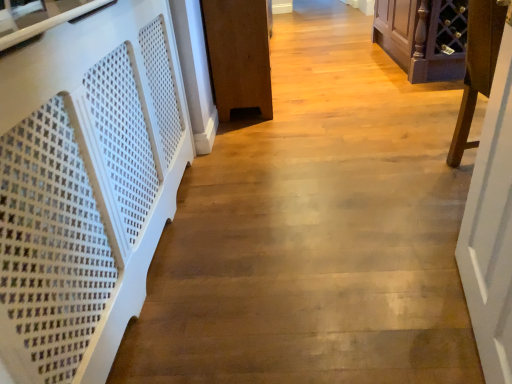
Question: Is purple wood wine rack at right, marked as the 2th furniture in a right-to-left arrangement, with white perforated panel at left?

Choices:
 (A) yes
 (B) no

Answer: (B)

Question: Is purple wood wine rack at right, which appears as the 2th furniture when viewed from the left, outside white perforated panel at left?

Choices:
 (A) no
 (B) yes

Answer: (B)

Question: Is purple wood wine rack at right, which appears as the 2th furniture when viewed from the left, at the left side of white perforated panel at left?

Choices:
 (A) yes
 (B) no

Answer: (B)

Question: Is purple wood wine rack at right, which appears as the 2th furniture when viewed from the left, further to the viewer compared to white perforated panel at left?

Choices:
 (A) no
 (B) yes

Answer: (B)

Question: Can you confirm if purple wood wine rack at right, which appears as the 2th furniture when viewed from the left, is taller than white perforated panel at left?

Choices:
 (A) no
 (B) yes

Answer: (B)

Question: Visually, is white wooden door at right positioned to the left or to the right of white perforated wood at left?

Choices:
 (A) right
 (B) left

Answer: (A)

Question: Do you think white wooden door at right is within white perforated wood at left, or outside of it?

Choices:
 (A) inside
 (B) outside

Answer: (B)

Question: Looking at their shapes, would you say white wooden door at right is wider or thinner than white perforated wood at left?

Choices:
 (A) thin
 (B) wide

Answer: (A)

Question: Is point (476, 185) positioned closer to the camera than point (69, 34)?

Choices:
 (A) closer
 (B) farther

Answer: (B)

Question: Is brown wood cabinet at center, the 3th furniture viewed from the right, taller or shorter than purple wood wine rack at right, marked as the 2th furniture in a right-to-left arrangement?

Choices:
 (A) short
 (B) tall

Answer: (A)

Question: Looking at the image, does brown wood cabinet at center, the 3th furniture viewed from the right, seem bigger or smaller compared to purple wood wine rack at right, marked as the 2th furniture in a right-to-left arrangement?

Choices:
 (A) big
 (B) small

Answer: (A)

Question: In the image, is brown wood cabinet at center, which is the 1th furniture from left to right, positioned in front of or behind purple wood wine rack at right, marked as the 2th furniture in a right-to-left arrangement?

Choices:
 (A) front
 (B) behind

Answer: (B)

Question: From the image's perspective, relative to purple wood wine rack at right, which appears as the 2th furniture when viewed from the left, is brown wood cabinet at center, the 3th furniture viewed from the right, above or below?

Choices:
 (A) above
 (B) below

Answer: (A)

Question: Looking at the image, does brown wood cabinet at center, which is the 1th furniture from left to right, seem bigger or smaller compared to dark wood wine rack at upper right, the 1th furniture in the right-to-left sequence?

Choices:
 (A) big
 (B) small

Answer: (B)

Question: Considering the positions of brown wood cabinet at center, which is the 1th furniture from left to right, and dark wood wine rack at upper right, the third furniture positioned from the left, in the image, is brown wood cabinet at center, which is the 1th furniture from left to right, wider or thinner than dark wood wine rack at upper right, the third furniture positioned from the left,?

Choices:
 (A) wide
 (B) thin

Answer: (B)